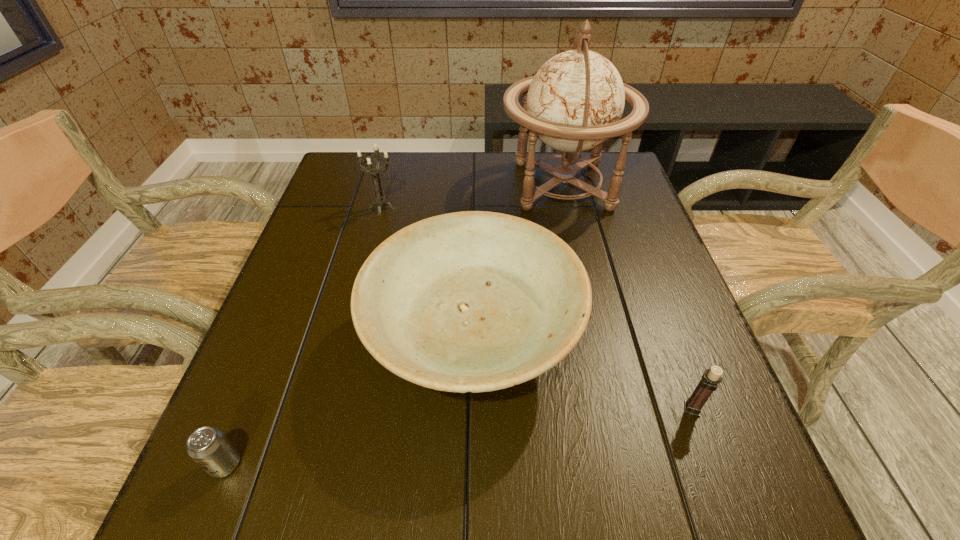
Where is `vacant space located at the front of the globe showing Africa`? This screenshot has width=960, height=540. vacant space located at the front of the globe showing Africa is located at coordinates (475, 185).

I want to click on vacant space located on the back of the dish, so click(x=474, y=217).

Identify the location of vacant space located 0.070m on the front of the taller candle holder. The image size is (960, 540). (375, 234).

Find the location of a particular element. This screenshot has height=540, width=960. blank space located on the back of the second shortest object is located at coordinates (656, 309).

Image resolution: width=960 pixels, height=540 pixels. What are the coordinates of `vacant area located 0.300m on the back of the shortest object` in the screenshot? It's located at (288, 309).

Find the location of `object located in the far edge section of the desktop`. object located in the far edge section of the desktop is located at coordinates (575, 101).

The width and height of the screenshot is (960, 540). What are the coordinates of `object present at the near edge` in the screenshot? It's located at (207, 446).

Identify the location of candle holder positioned at the left edge. (380, 200).

The height and width of the screenshot is (540, 960). I want to click on beer can located in the left edge section of the desktop, so click(x=207, y=446).

At what (x,y) coordinates should I click in order to perform the action: click on globe located at the right edge. Please return your answer as a coordinate pair (x, y). Image resolution: width=960 pixels, height=540 pixels. Looking at the image, I should click on coord(575,101).